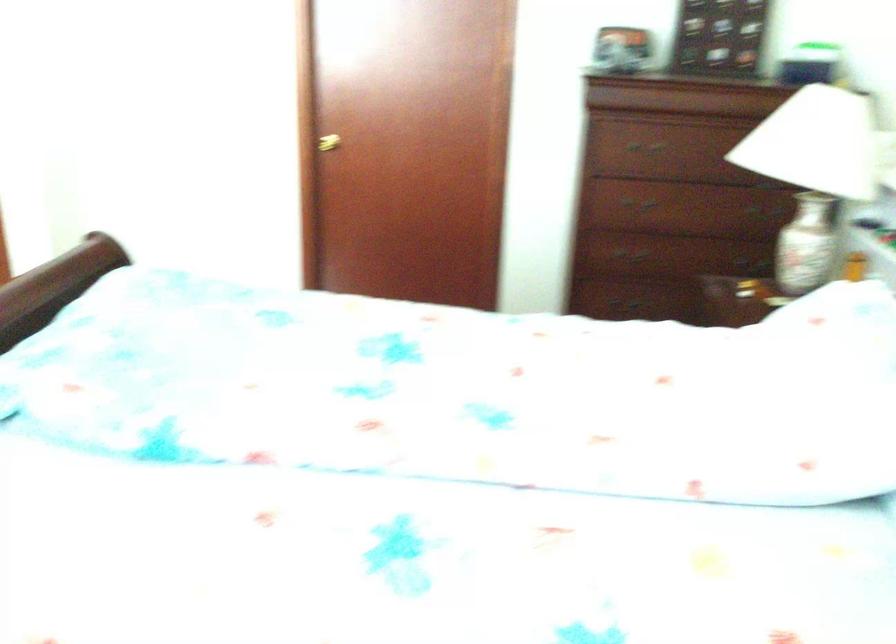
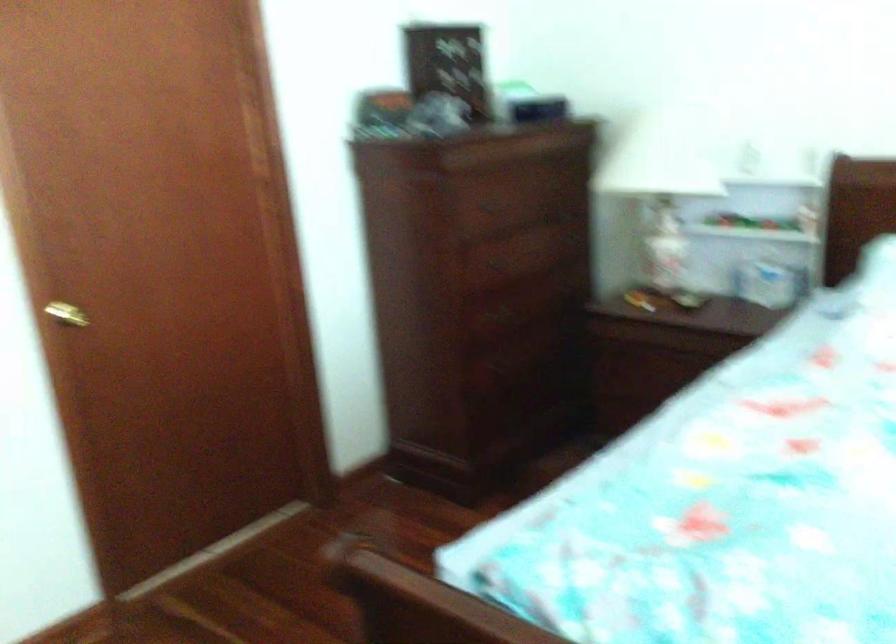
Where in the second image is the point corresponding to the point at 331,147 from the first image?

(66, 314)